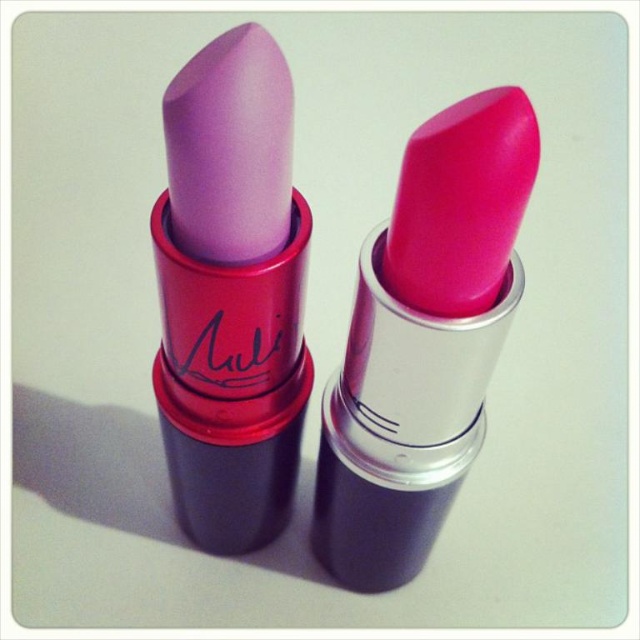
Question: Among these points, which one is farthest from the camera?

Choices:
 (A) (467, 176)
 (B) (291, 371)

Answer: (B)

Question: Which point appears closest to the camera in this image?

Choices:
 (A) (289, 218)
 (B) (420, 444)

Answer: (A)

Question: Which point appears farthest from the camera in this image?

Choices:
 (A) (476, 340)
 (B) (179, 291)

Answer: (B)

Question: Can you confirm if matte pink lipstick at center is positioned below matte purple lipstick at left?

Choices:
 (A) no
 (B) yes

Answer: (B)

Question: From the image, what is the correct spatial relationship of matte pink lipstick at center in relation to matte purple lipstick at left?

Choices:
 (A) right
 (B) left

Answer: (A)

Question: Considering the relative positions of matte pink lipstick at center and matte purple lipstick at left in the image provided, where is matte pink lipstick at center located with respect to matte purple lipstick at left?

Choices:
 (A) right
 (B) left

Answer: (A)